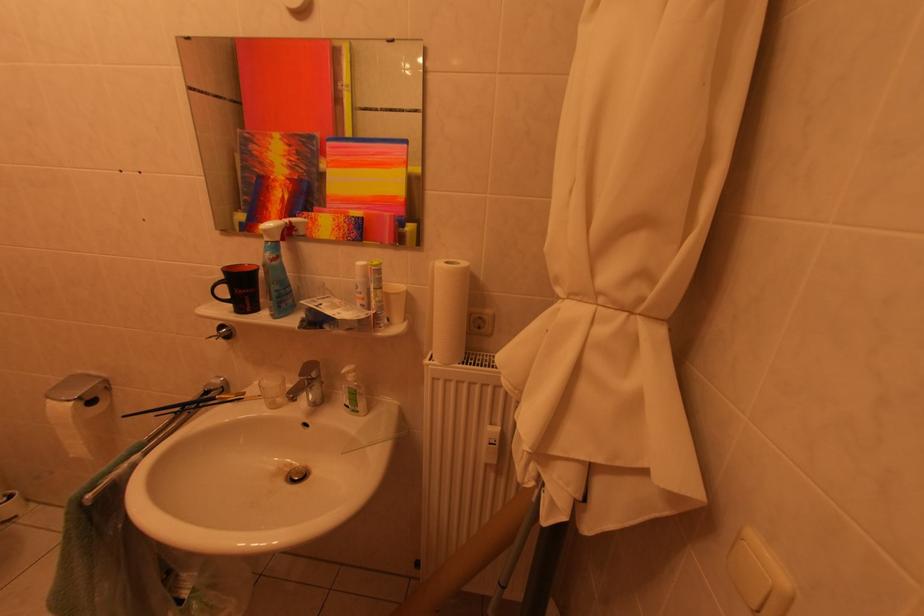
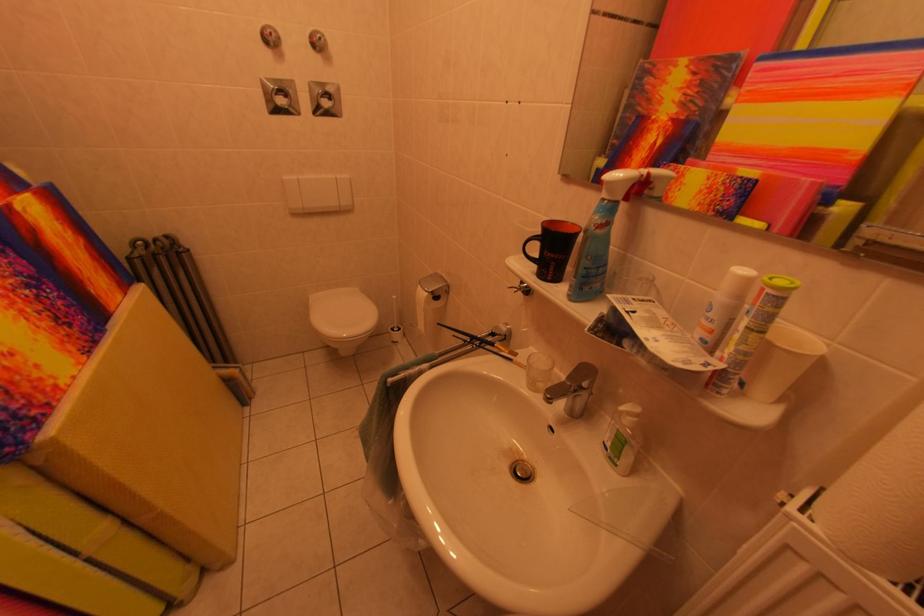
Question: I am providing you with two images of the same scene from different viewpoints. Please identify which objects are invisible in image2.

Choices:
 (A) sink faucet handle
 (B) toilet brush handle
 (C) small drinking glass
 (D) none of these

Answer: (D)